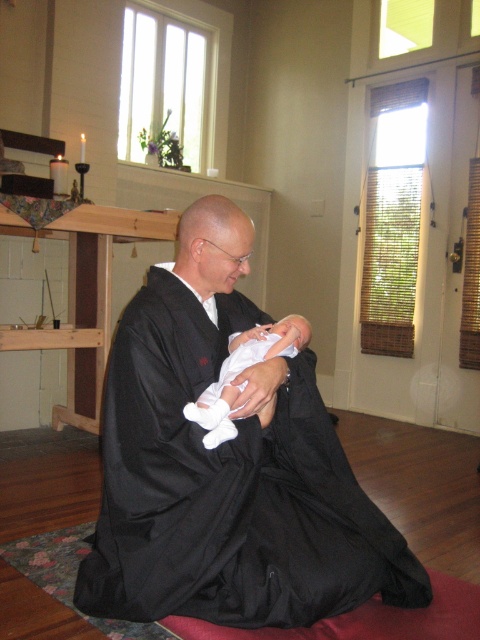
Who is more forward, (213, 522) or (296, 348)?

Positioned in front is point (213, 522).

Between white matte dress at center and white soft fabric newborn at center, which one is positioned higher?

white soft fabric newborn at center is above.

Who is more forward, (319, 470) or (264, 406)?

Point (264, 406)

Find the location of `white matte dress at center`. white matte dress at center is located at coordinates (227, 486).